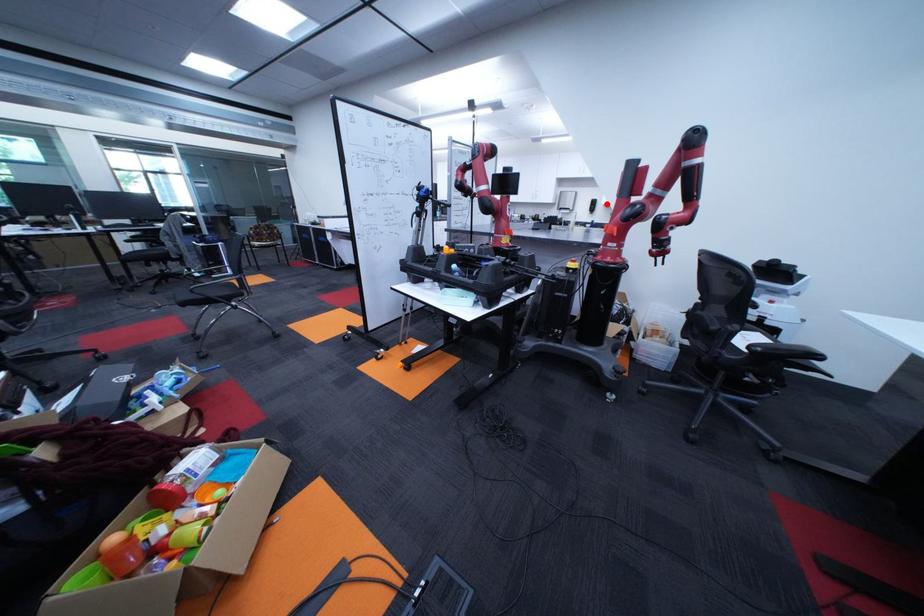
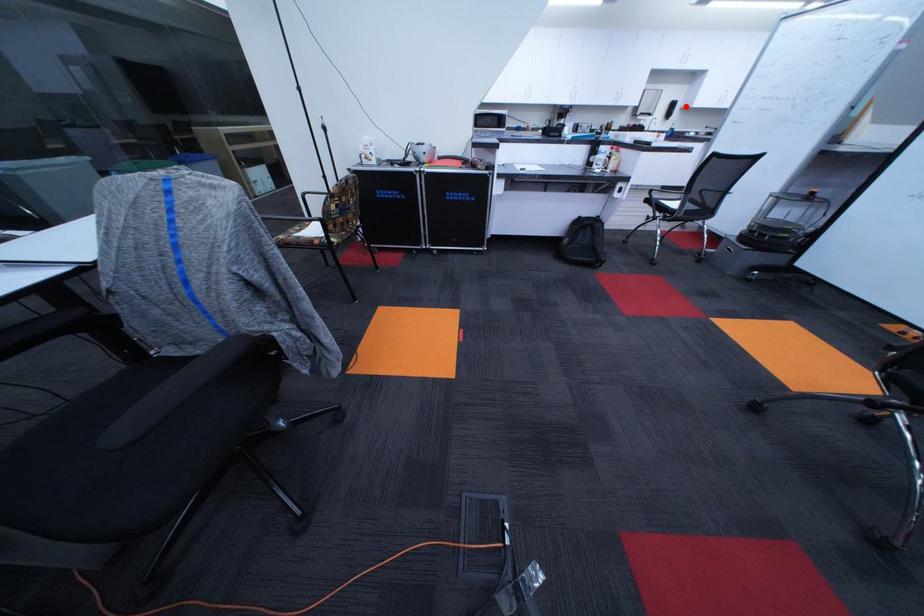
I am providing you with two images of the same scene from different viewpoints. A red point is marked on the first image and another point is marked on the second image. Is the red point in image1 aligned with the point shown in image2?

Yes